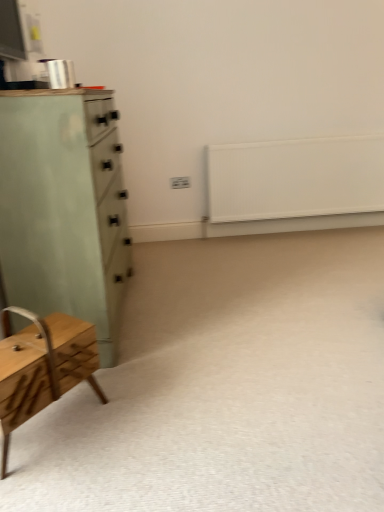
In order to face green matte cabinet at left, should I rotate leftwards or rightwards?

You should look left and rotate roughly 14.840 degrees.

The height and width of the screenshot is (512, 384). In order to click on green matte cabinet at left in this screenshot , I will do `click(64, 207)`.

This screenshot has width=384, height=512. What do you see at coordinates (64, 207) in the screenshot?
I see `green matte cabinet at left` at bounding box center [64, 207].

The image size is (384, 512). Find the location of `green matte cabinet at left`. green matte cabinet at left is located at coordinates [64, 207].